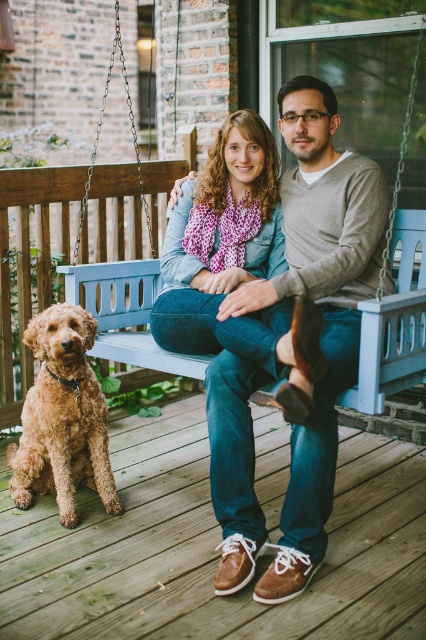
Question: Can you confirm if blue wooden swing at center is positioned below denim scarf at center?

Choices:
 (A) yes
 (B) no

Answer: (B)

Question: Does blue wooden swing at center lie behind golden curly fur dog at lower left?

Choices:
 (A) no
 (B) yes

Answer: (B)

Question: Among these points, which one is nearest to the camera?

Choices:
 (A) (63, 467)
 (B) (249, 392)

Answer: (B)

Question: Based on their relative distances, which object is nearer to the golden curly fur dog at lower left?

Choices:
 (A) matte brown shoes at center
 (B) denim scarf at center
 (C) blue wooden swing at center

Answer: (B)

Question: Does blue wooden swing at center have a larger size compared to golden curly fur dog at lower left?

Choices:
 (A) no
 (B) yes

Answer: (B)

Question: Among these points, which one is farthest from the camera?

Choices:
 (A) (250, 372)
 (B) (333, 61)
 (C) (172, 316)
 (D) (86, 369)

Answer: (B)